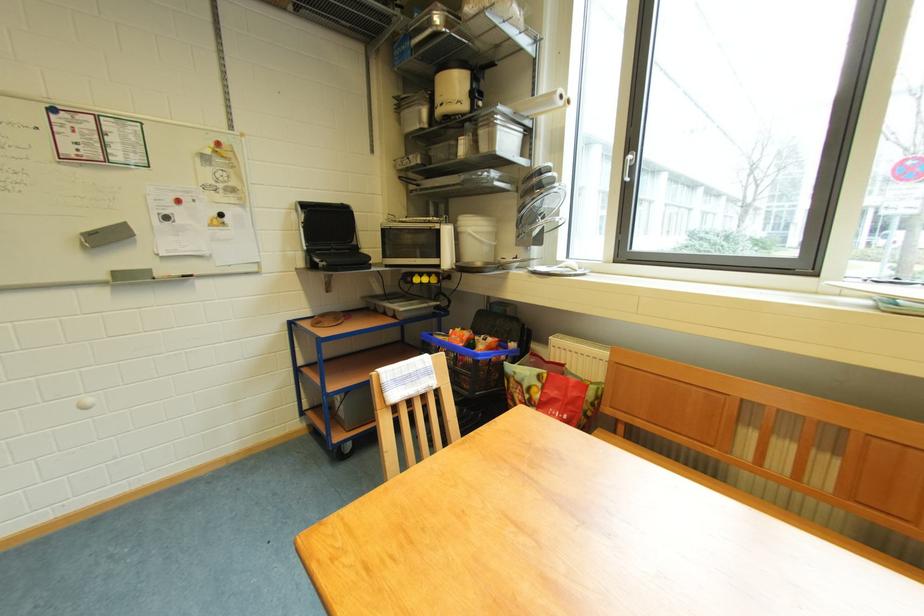
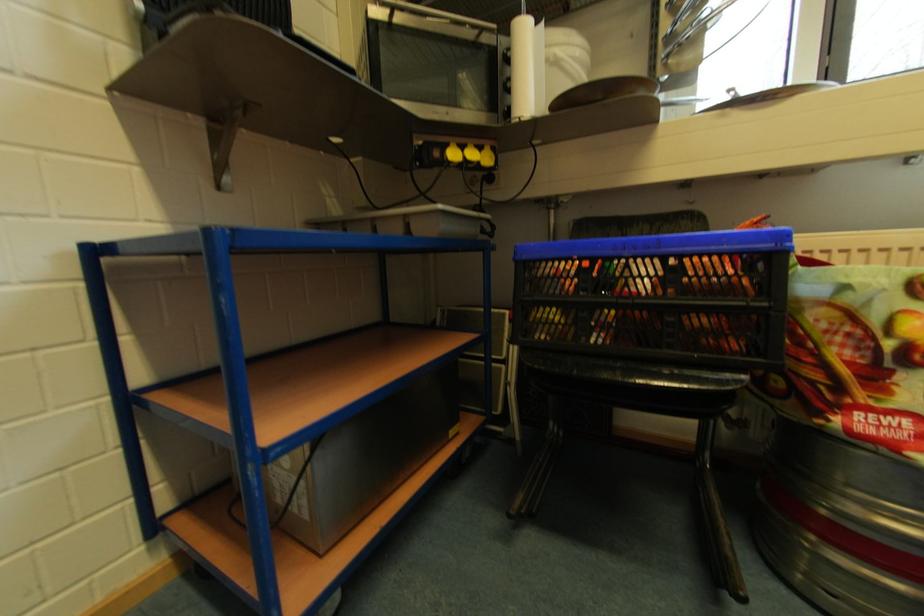
Which direction would the cameraman need to move to produce the second image?

The movement direction of the cameraman is left, forward.